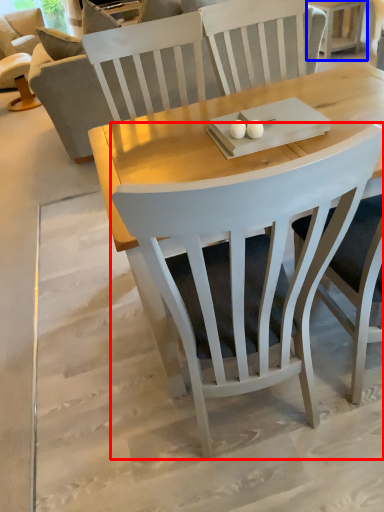
Question: Which object appears closest to the camera in this image, chair (highlighted by a red box) or side table (highlighted by a blue box)?

Choices:
 (A) chair
 (B) side table

Answer: (A)